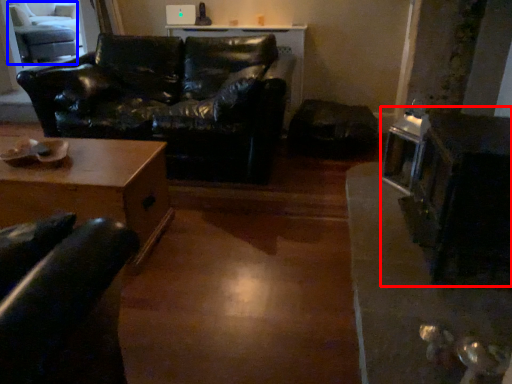
Question: Which point is further to the camera, appliance (highlighted by a red box) or swivel chair (highlighted by a blue box)?

Choices:
 (A) appliance
 (B) swivel chair

Answer: (B)